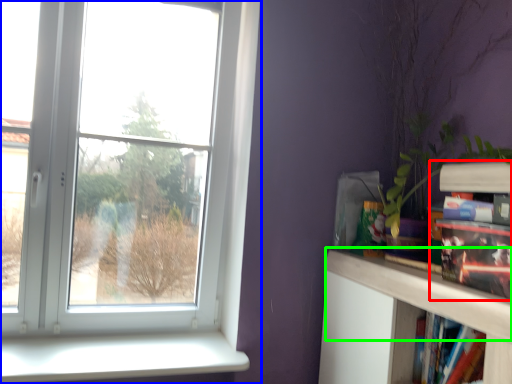
Question: Which object is the closest to the book (highlighted by a red box)? Choose among these: window (highlighted by a blue box) or mantle (highlighted by a green box).

Choices:
 (A) window
 (B) mantle

Answer: (B)